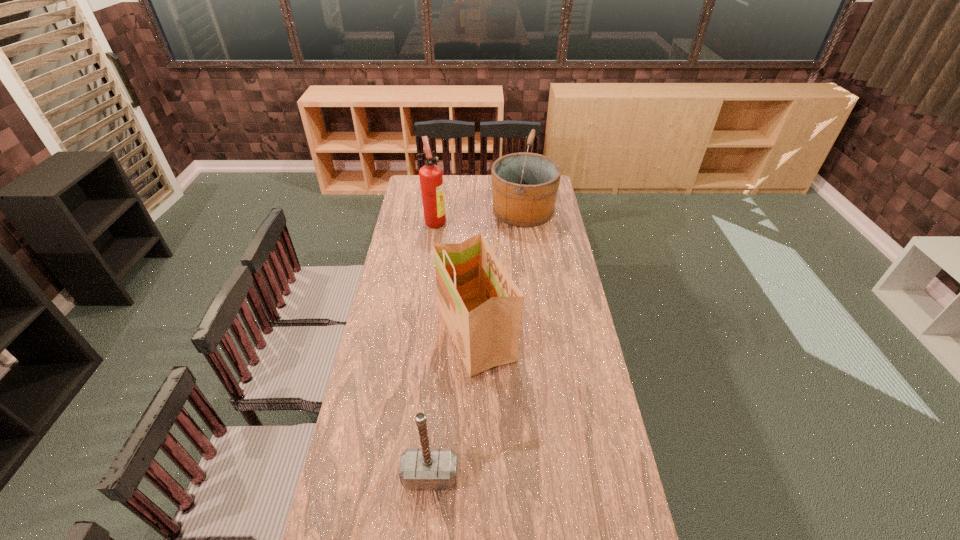
Choose which object is the nearest neighbor to the grocery bag. Please provide its 2D coordinates. Your answer should be formatted as a tuple, i.e. [(x, y)], where the tuple contains the x and y coordinates of a point satisfying the conditions above.

[(425, 468)]

Select which object is the third closest to the fire extinguisher. Please provide its 2D coordinates. Your answer should be formatted as a tuple, i.e. [(x, y)], where the tuple contains the x and y coordinates of a point satisfying the conditions above.

[(425, 468)]

Image resolution: width=960 pixels, height=540 pixels. I want to click on free space that satisfies the following two spatial constraints: 1. on the front-facing side of the fire extinguisher; 2. on the left side of the second nearest object, so (x=420, y=334).

Image resolution: width=960 pixels, height=540 pixels. I want to click on vacant space that satisfies the following two spatial constraints: 1. on the front-facing side of the second nearest object; 2. on the left side of the fire extinguisher, so click(x=420, y=334).

Locate an element on the screen. The image size is (960, 540). vacant space that satisfies the following two spatial constraints: 1. on the back side of the bucket; 2. on the right side of the second nearest object is located at coordinates (477, 210).